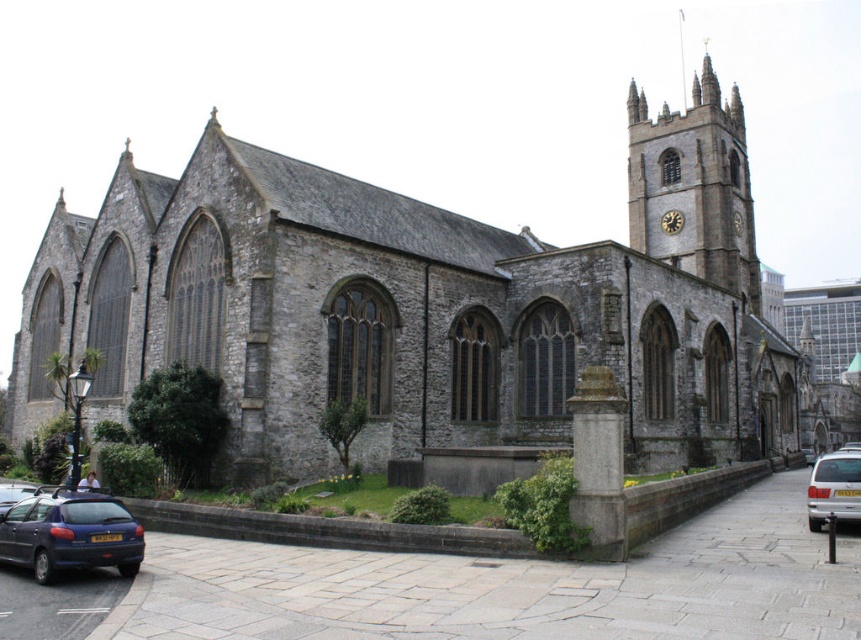
Is stone clock tower at upper right shorter than matte blue car at lower left?

In fact, stone clock tower at upper right may be taller than matte blue car at lower left.

Identify the location of stone clock tower at upper right. (692, 188).

Does point (54, 524) lie behind point (822, 461)?

No, it is in front of (822, 461).

Consider the image. Is matte blue car at lower left above silver metallic van at lower right?

Indeed, matte blue car at lower left is positioned over silver metallic van at lower right.

Is point (60, 492) positioned before point (856, 483)?

Yes.

In order to click on matte blue car at lower left in this screenshot , I will do `click(70, 532)`.

Between stone clock tower at upper right and metallic blue car at lower left, which one is positioned higher?

stone clock tower at upper right is above.

Between point (629, 106) and point (22, 493), which one is positioned behind?

Point (629, 106)

At what (x,y) coordinates should I click in order to perform the action: click on stone clock tower at upper right. Please return your answer as a coordinate pair (x, y). Looking at the image, I should click on (692, 188).